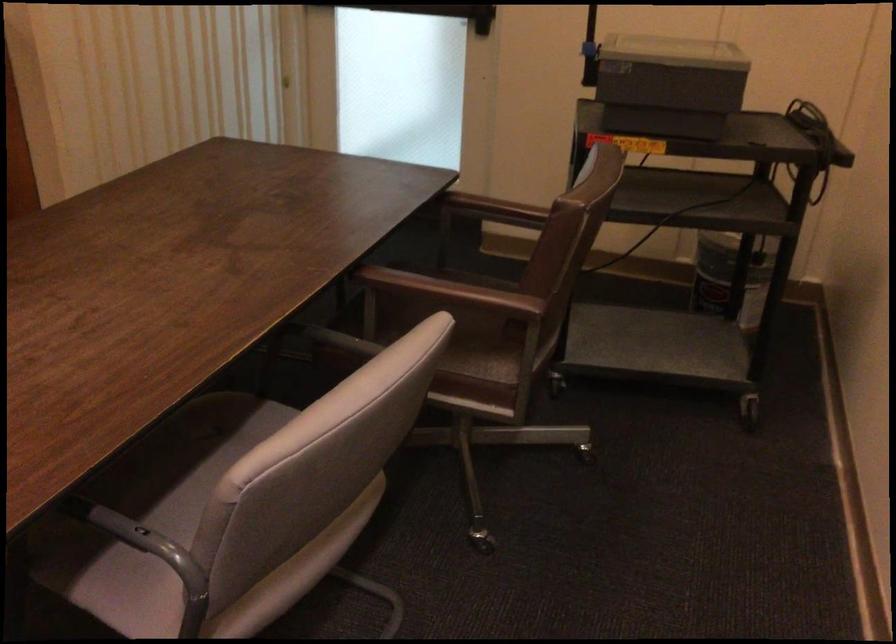
Find the location of a particular element. The width and height of the screenshot is (896, 644). brown chair armrest is located at coordinates pyautogui.click(x=460, y=289).